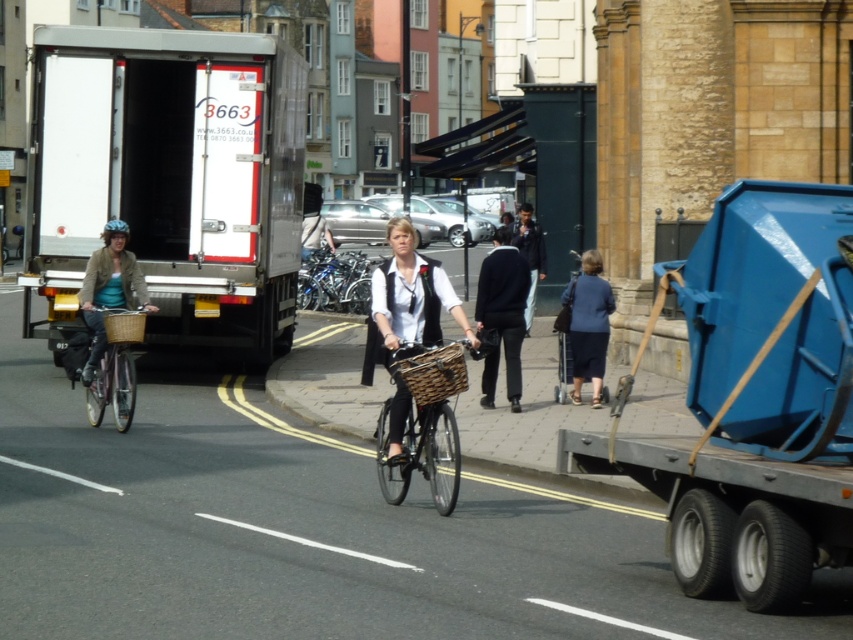
The height and width of the screenshot is (640, 853). Find the location of `blue fabric dress at lower right`. blue fabric dress at lower right is located at coordinates pos(589,324).

Who is taller, blue fabric dress at lower right or matte wicker basket at left?

With more height is blue fabric dress at lower right.

Locate an element on the screen. This screenshot has height=640, width=853. blue fabric dress at lower right is located at coordinates (589, 324).

You are a GUI agent. You are given a task and a screenshot of the screen. Output one action in this format:
    pyautogui.click(x=<x>, y=<y>)
    Task: Click on the blue fabric dress at lower right
    This screenshot has width=853, height=640.
    Given the screenshot: What is the action you would take?
    pyautogui.click(x=589, y=324)

Is blue plastic container at right shorter than matte black bicycle at center?

No, blue plastic container at right is not shorter than matte black bicycle at center.

Who is positioned more to the right, blue plastic container at right or matte black bicycle at center?

matte black bicycle at center

Identify the location of blue plastic container at right. (753, 397).

Find the location of a particular element. white matte truck at left is located at coordinates (171, 177).

The height and width of the screenshot is (640, 853). Describe the element at coordinates (171, 177) in the screenshot. I see `white matte truck at left` at that location.

Where is `white matte truck at left`? white matte truck at left is located at coordinates (171, 177).